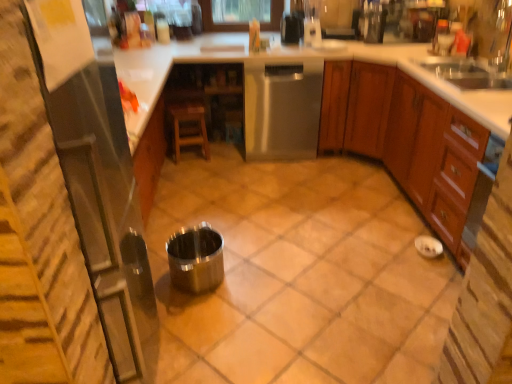
Locate an element on the screen. free point in front of wooden stool at center is located at coordinates (198, 172).